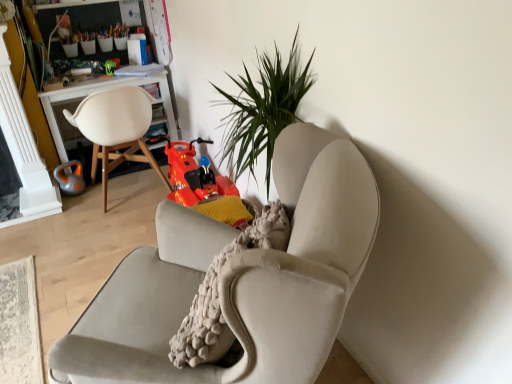
At what (x,y) coordinates should I click in order to perform the action: click on free point below white matte chair at left, placed as the 2th chair when sorted from right to left (from a real-world perspective). Please return your answer as a coordinate pair (x, y). This screenshot has height=384, width=512. Looking at the image, I should click on (130, 187).